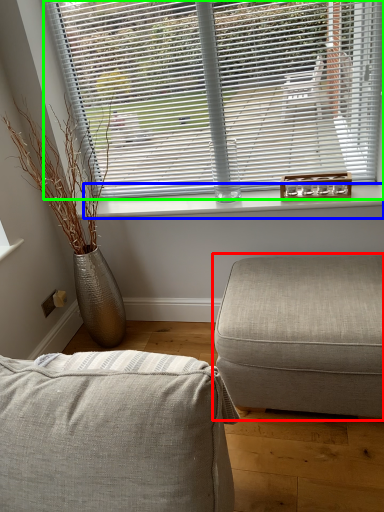
Question: Which object is positioned farthest from studio couch (highlighted by a red box)? Select from window sill (highlighted by a blue box) and window blind (highlighted by a green box).

Choices:
 (A) window sill
 (B) window blind

Answer: (B)